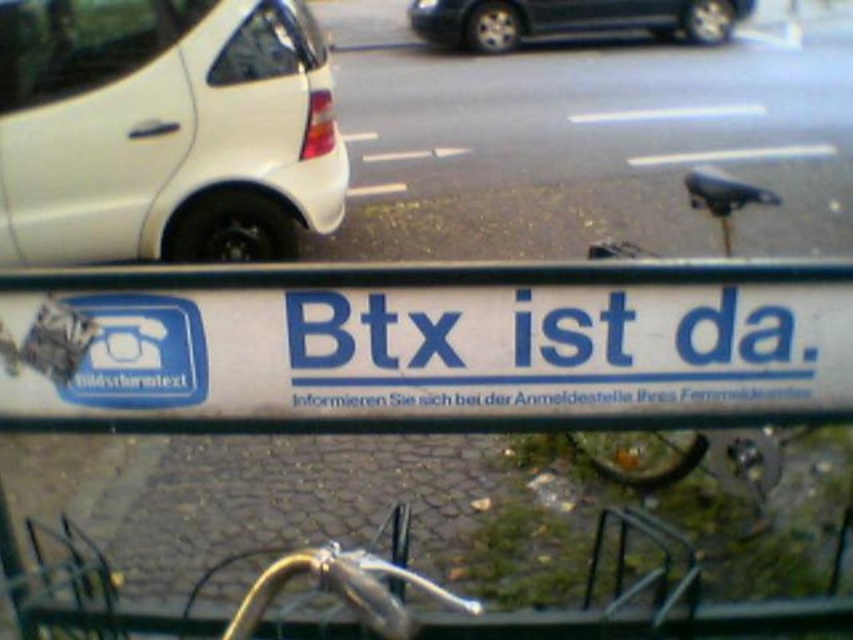
Who is lower down, white plastic sign at center or white matte car at left?

white plastic sign at center is below.

Which is in front, point (252, 308) or point (155, 76)?

Point (252, 308)

Does point (364, 314) lie in front of point (41, 134)?

Yes, point (364, 314) is in front of point (41, 134).

The height and width of the screenshot is (640, 853). What are the coordinates of `white plastic sign at center` in the screenshot? It's located at (428, 346).

Between white matte car at left and black glossy car at upper center, which one has less height?

With less height is black glossy car at upper center.

Is white matte car at left bigger than black glossy car at upper center?

No.

The height and width of the screenshot is (640, 853). In order to click on white matte car at left in this screenshot , I will do `click(161, 129)`.

Image resolution: width=853 pixels, height=640 pixels. What are the coordinates of `white matte car at left` in the screenshot? It's located at (161, 129).

Based on the photo, is the position of white plastic sign at center more distant than that of black glossy car at upper center?

No, it is not.

Based on the photo, measure the distance between white plastic sign at center and camera.

white plastic sign at center is 1.54 meters from camera.

You are a GUI agent. You are given a task and a screenshot of the screen. Output one action in this format:
    pyautogui.click(x=<x>, y=<y>)
    Task: Click on the white plastic sign at center
    This screenshot has width=853, height=640.
    Given the screenshot: What is the action you would take?
    pyautogui.click(x=428, y=346)